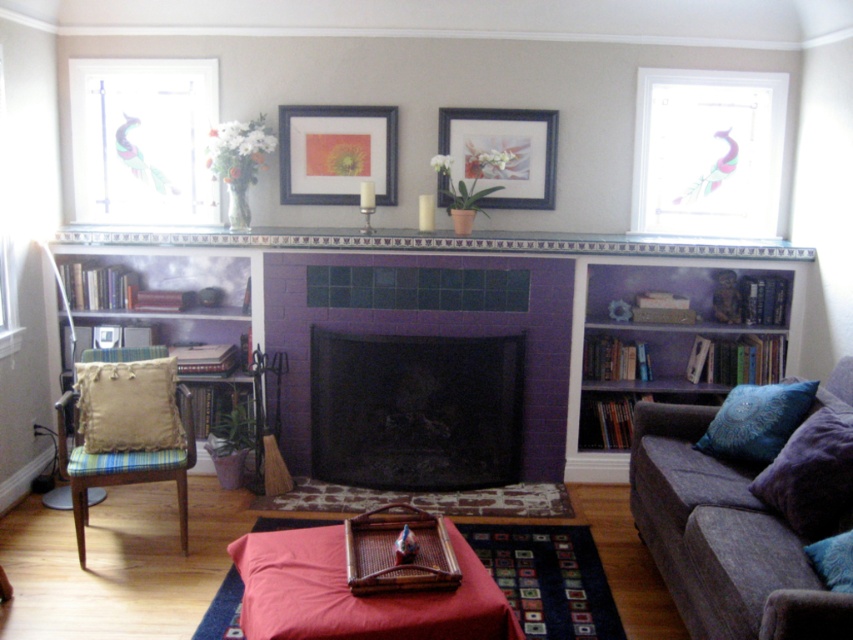
You are organizing a living room and need to move the beige fabric pillow at left and the teal velvet cushion at right. Which cushion is positioned behind the other?

The teal velvet cushion at right is positioned behind the beige fabric pillow at left.

You are arranging a cozy reading corner in the living room. You have the purple velvet pillow at lower right and the beige fabric cushioned chair at left. Where should you place the pillow relative to the chair to maintain the existing spatial arrangement?

The purple velvet pillow at lower right should be placed below the beige fabric cushioned chair at left to maintain the existing spatial arrangement.